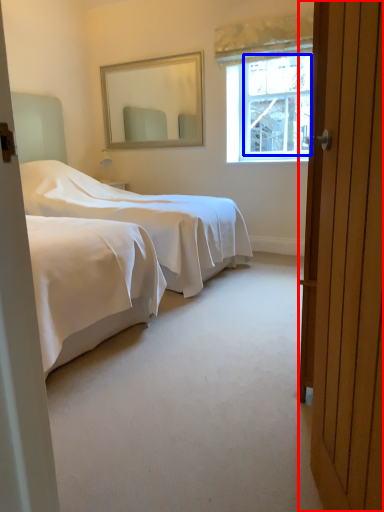
Question: Which of the following is the farthest to the observer, door (highlighted by a red box) or window screen (highlighted by a blue box)?

Choices:
 (A) door
 (B) window screen

Answer: (B)